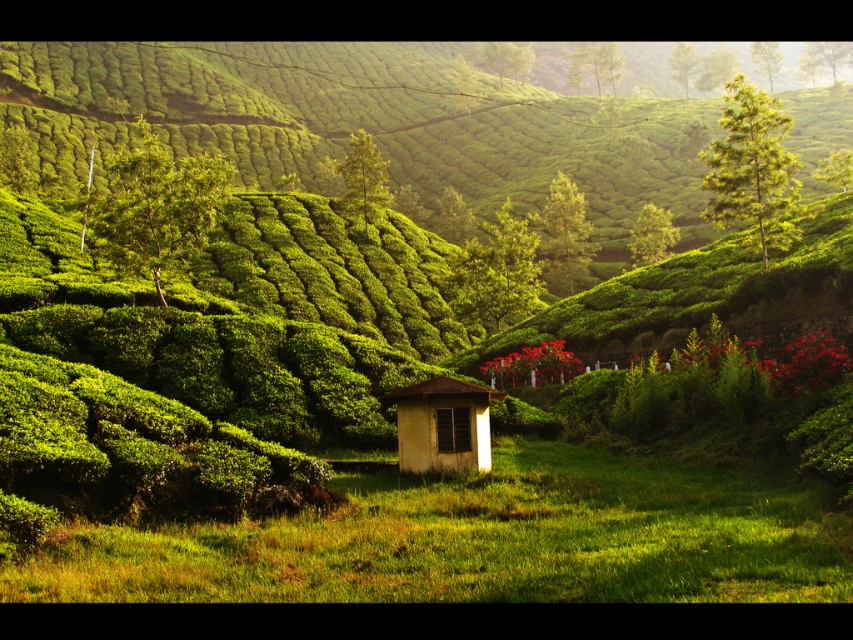
You are standing at the point labeled as point (485, 540) in the image. Looking around, what do you see immediately around you?

You are standing in the green grassy field at center, as indicated by point (485, 540).

You are planning to set up a picnic in the serene landscape. You have a picnic blanket that can cover an area larger than the white matte gazebo at center. Will the green grassy field at center provide enough space for your blanket?

Answer: The green grassy field at center has a larger width than the white matte gazebo at center, so yes, the green grassy field at center will provide enough space for your picnic blanket since its width is greater than the gazebo.

You are planning to set up a picnic area in the green grassy field at center and the white matte gazebo at center. Which location would allow you to accommodate more people comfortably?

The green grassy field at center has a larger size compared to the white matte gazebo at center, so it can accommodate more people comfortably.